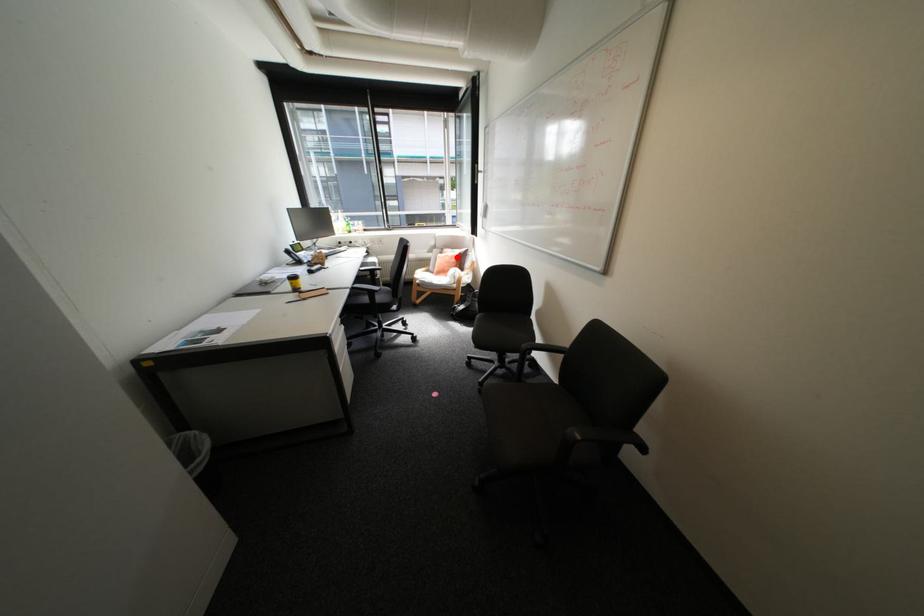
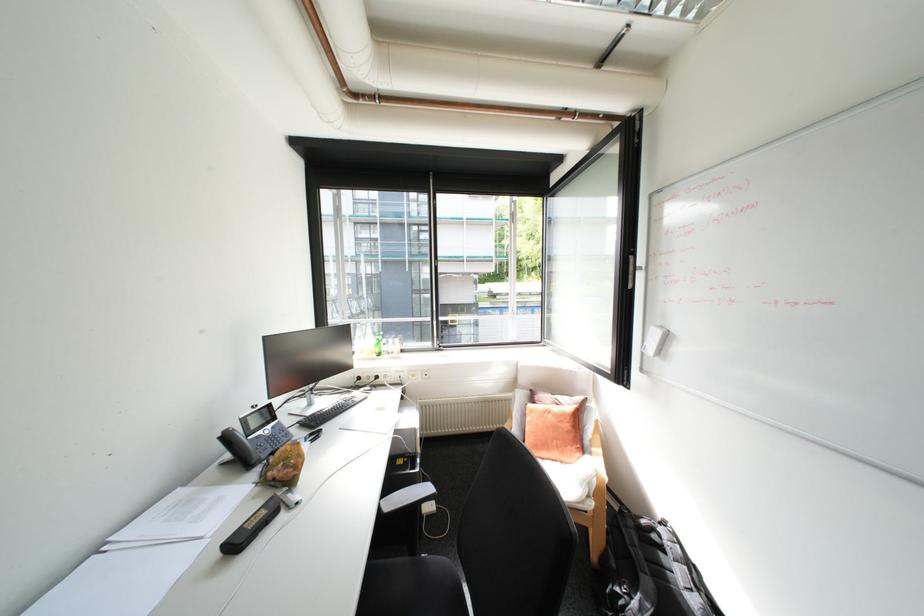
Find the pixel in the second image that matches the highlighted location in the first image.

(561, 416)